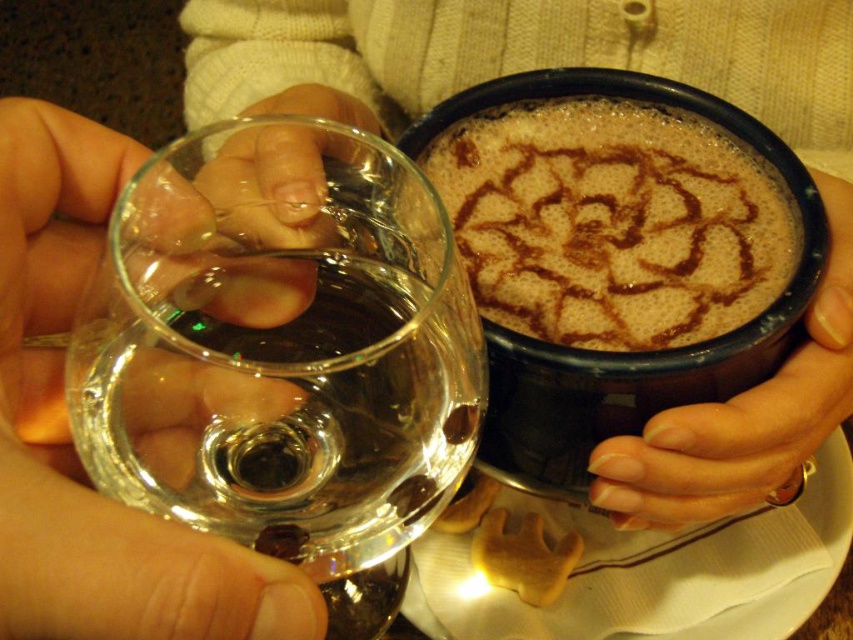
Is point (698, 65) positioned in front of point (842, 288)?

No, (698, 65) is further to viewer.

Is point (242, 76) positioned after point (704, 436)?

Yes.

Does point (428, 100) lie in front of point (799, 397)?

No, it is not.

At what (x,y) coordinates should I click in order to perform the action: click on clear glass wine at left. Please return your answer as a coordinate pair (x, y). The height and width of the screenshot is (640, 853). Looking at the image, I should click on (602, 65).

Which is below, brown frothy coffee at upper center or nail polish on fingernails at right?

nail polish on fingernails at right is below.

Identify the location of brown frothy coffee at upper center. (613, 221).

Can you confirm if clear glass wine at left is bigger than brown frothy coffee at upper center?

Yes.

Is clear glass wine at left closer to camera compared to brown frothy coffee at upper center?

Yes.

Locate an element on the screen. The height and width of the screenshot is (640, 853). clear glass wine at left is located at coordinates (602, 65).